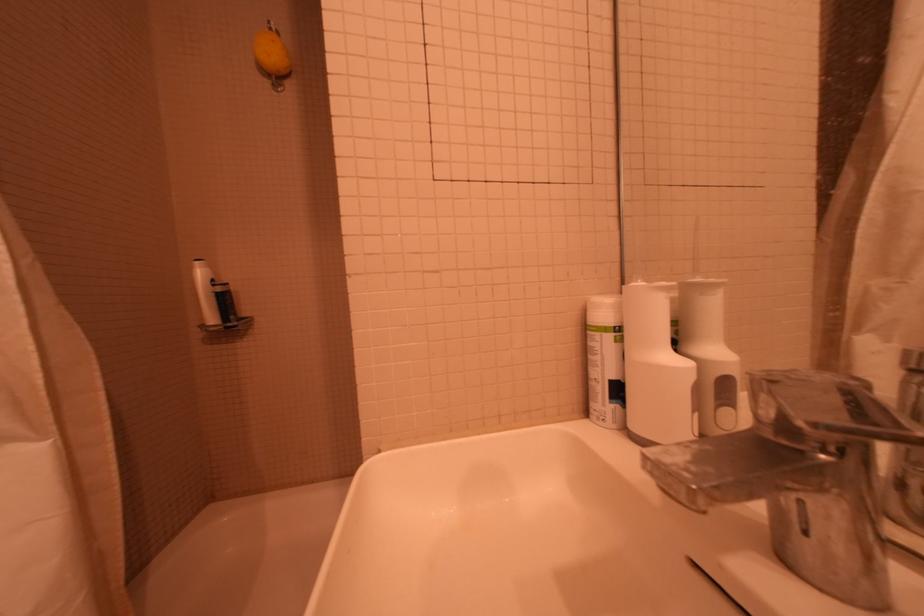
Which object does [654,369] point to?

It corresponds to the white bottle in the image.